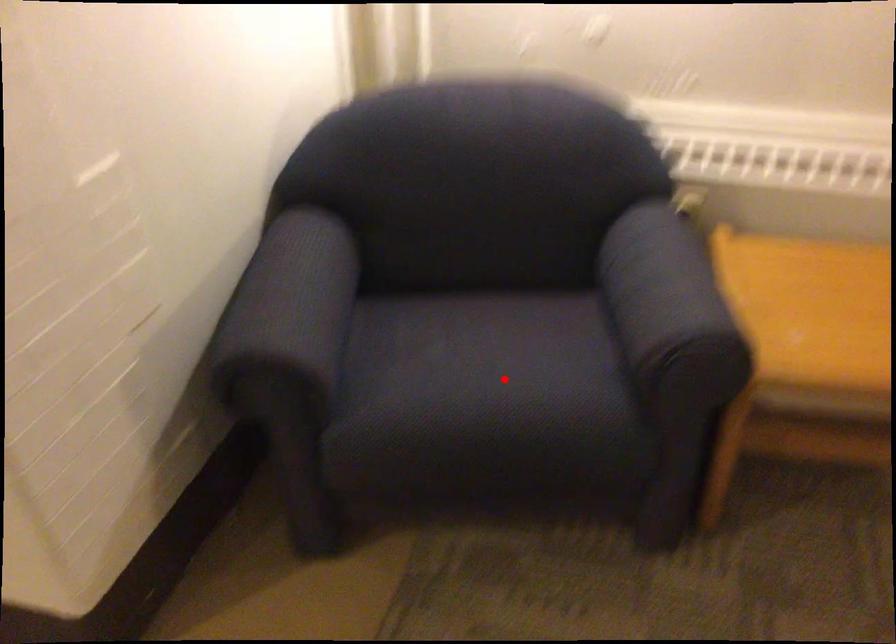
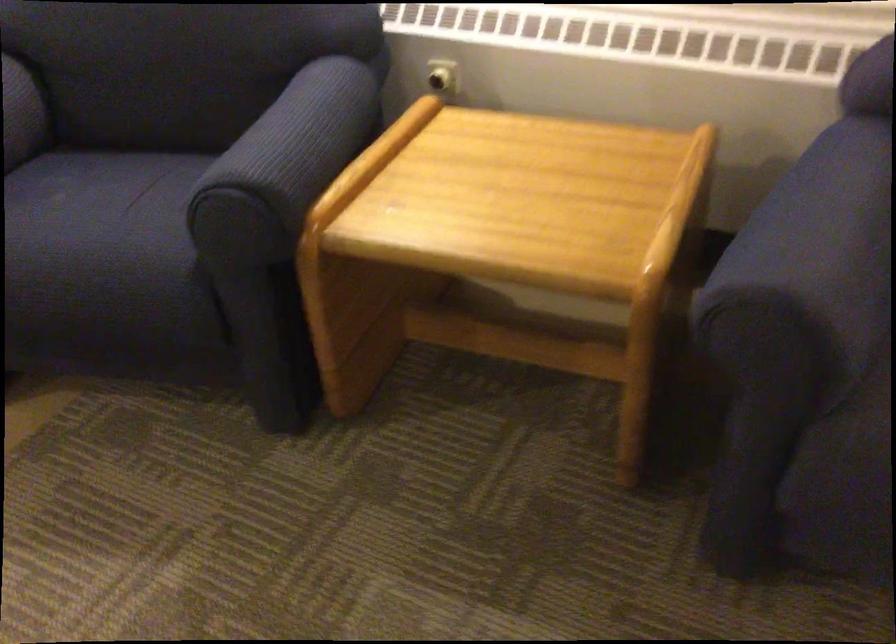
Locate, in the second image, the point that corresponds to the highlighted location in the first image.

(99, 232)